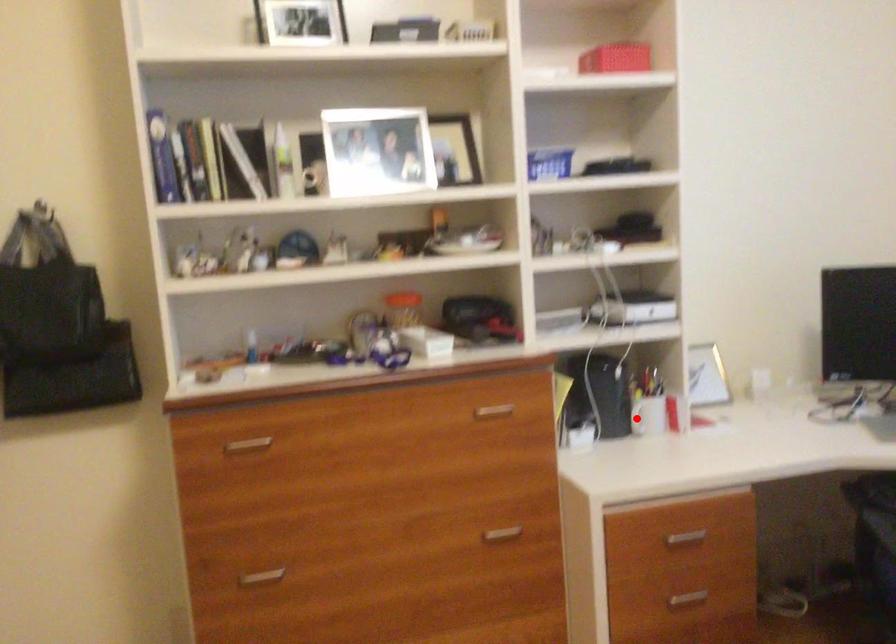
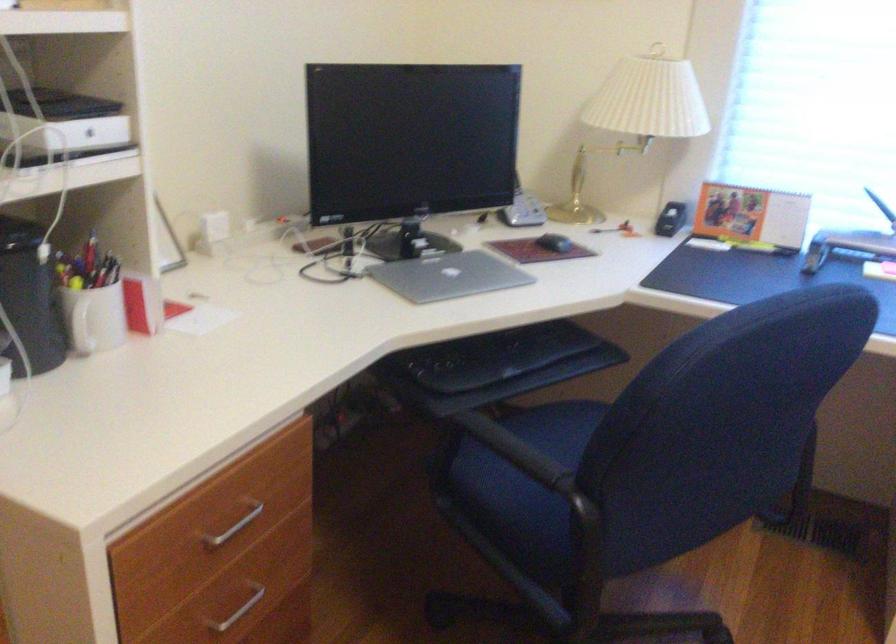
Question: I am providing you with two images of the same scene from different viewpoints. Given a red point in image1, look at the same physical point in image2. Is it:

Choices:
 (A) Closer to the viewpoint
 (B) Farther from the viewpoint

Answer: (A)